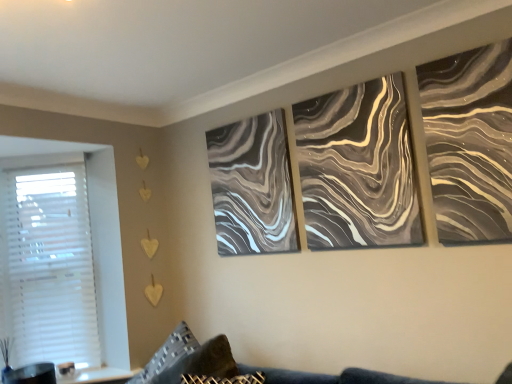
Question: Considering the relative positions of white plastic blinds at left and metallic silver abstract art at upper right in the image provided, is white plastic blinds at left behind metallic silver abstract art at upper right?

Choices:
 (A) no
 (B) yes

Answer: (B)

Question: Considering the relative positions of white plastic blinds at left and metallic silver abstract art at upper right in the image provided, is white plastic blinds at left to the left of metallic silver abstract art at upper right from the viewer's perspective?

Choices:
 (A) no
 (B) yes

Answer: (B)

Question: Does white plastic blinds at left have a greater height compared to metallic silver abstract art at upper right?

Choices:
 (A) yes
 (B) no

Answer: (A)

Question: Is white plastic blinds at left aimed at metallic silver abstract art at upper right?

Choices:
 (A) yes
 (B) no

Answer: (B)

Question: Is the surface of white plastic blinds at left in direct contact with metallic silver abstract art at upper right?

Choices:
 (A) yes
 (B) no

Answer: (B)

Question: Is point (467, 57) positioned closer to the camera than point (275, 145)?

Choices:
 (A) closer
 (B) farther

Answer: (A)

Question: From the image's perspective, is metallic silver abstract art at upper right above or below marble-like gray painting at center, which is the 1th canvas from back to front?

Choices:
 (A) below
 (B) above

Answer: (B)

Question: Is metallic silver abstract art at upper right situated inside marble-like gray painting at center, marked as the 2th canvas in a front-to-back arrangement, or outside?

Choices:
 (A) inside
 (B) outside

Answer: (B)

Question: Considering the positions of metallic silver abstract art at upper right and marble-like gray painting at center, which is the 1th canvas from back to front, in the image, is metallic silver abstract art at upper right taller or shorter than marble-like gray painting at center, which is the 1th canvas from back to front,?

Choices:
 (A) tall
 (B) short

Answer: (B)

Question: In terms of height, does velvet dark blue couch at lower center look taller or shorter compared to metallic silver abstract art at upper right?

Choices:
 (A) short
 (B) tall

Answer: (A)

Question: In the image, is velvet dark blue couch at lower center on the left side or the right side of metallic silver abstract art at upper right?

Choices:
 (A) right
 (B) left

Answer: (B)

Question: Considering the positions of velvet dark blue couch at lower center and metallic silver abstract art at upper right in the image, is velvet dark blue couch at lower center wider or thinner than metallic silver abstract art at upper right?

Choices:
 (A) wide
 (B) thin

Answer: (A)

Question: Is velvet dark blue couch at lower center bigger or smaller than metallic silver abstract art at upper right?

Choices:
 (A) small
 (B) big

Answer: (B)

Question: Does point (234, 215) appear closer or farther from the camera than point (378, 142)?

Choices:
 (A) closer
 (B) farther

Answer: (B)

Question: In terms of height, does marble-like gray painting at center, which is the 1th canvas from back to front, look taller or shorter compared to metallic swirl canvas at center, the second canvas positioned from the left?

Choices:
 (A) short
 (B) tall

Answer: (B)